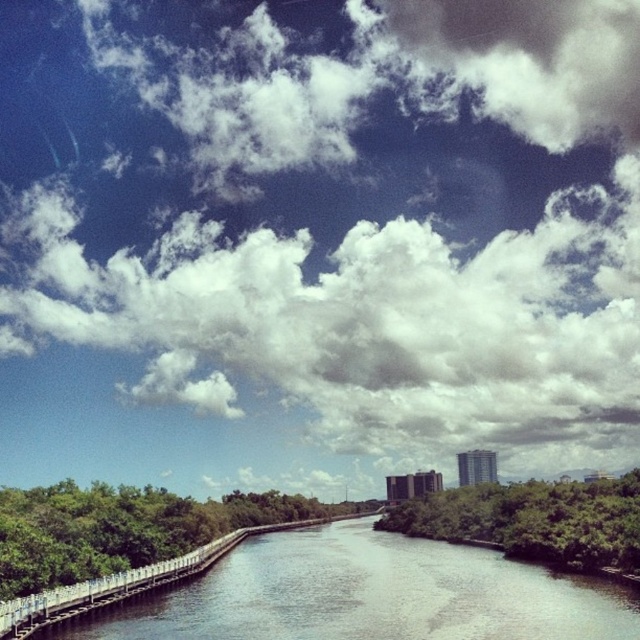
Does point (317, 609) come closer to viewer compared to point (104, 582)?

Yes, point (317, 609) is closer to viewer.

Is point (460, 600) behind point (19, 600)?

That is True.

Is point (376, 628) less distant than point (24, 600)?

Yes, point (376, 628) is closer to viewer.

You are a GUI agent. You are given a task and a screenshot of the screen. Output one action in this format:
    pyautogui.click(x=<x>, y=<y>)
    Task: Click on the greenish-gray concrete river at center
    Image resolution: width=640 pixels, height=640 pixels.
    Given the screenshot: What is the action you would take?
    pyautogui.click(x=365, y=595)

Is point (410, 1) closer to camera compared to point (8, 637)?

No, it is not.

The width and height of the screenshot is (640, 640). What do you see at coordinates (369, 227) in the screenshot? I see `white fluffy cloud at upper center` at bounding box center [369, 227].

Where is `white fluffy cloud at upper center`? This screenshot has height=640, width=640. white fluffy cloud at upper center is located at coordinates (369, 227).

Can you confirm if white fluffy cloud at upper center is taller than greenish-gray concrete river at center?

Indeed, white fluffy cloud at upper center has a greater height compared to greenish-gray concrete river at center.

Is white fluffy cloud at upper center further to camera compared to greenish-gray concrete river at center?

Yes, white fluffy cloud at upper center is further from the viewer.

This screenshot has width=640, height=640. I want to click on white fluffy cloud at upper center, so click(369, 227).